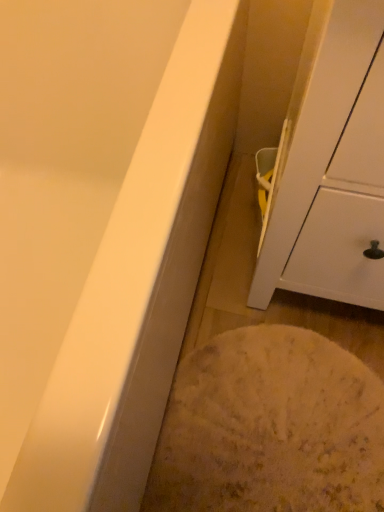
Question: Looking at the image, does white textured rug at lower center seem bigger or smaller compared to white matte cabinet at right?

Choices:
 (A) small
 (B) big

Answer: (A)

Question: Based on their positions, is white textured rug at lower center located to the left or right of white matte cabinet at right?

Choices:
 (A) left
 (B) right

Answer: (A)

Question: Is white textured rug at lower center taller or shorter than white matte cabinet at right?

Choices:
 (A) tall
 (B) short

Answer: (B)

Question: Considering the positions of white matte cabinet at right and white textured rug at lower center in the image, is white matte cabinet at right bigger or smaller than white textured rug at lower center?

Choices:
 (A) big
 (B) small

Answer: (A)

Question: Does point (274, 278) appear closer or farther from the camera than point (264, 437)?

Choices:
 (A) farther
 (B) closer

Answer: (B)

Question: In terms of width, does white matte cabinet at right look wider or thinner when compared to white textured rug at lower center?

Choices:
 (A) thin
 (B) wide

Answer: (B)

Question: Is white matte cabinet at right in front of or behind white textured rug at lower center in the image?

Choices:
 (A) behind
 (B) front

Answer: (B)